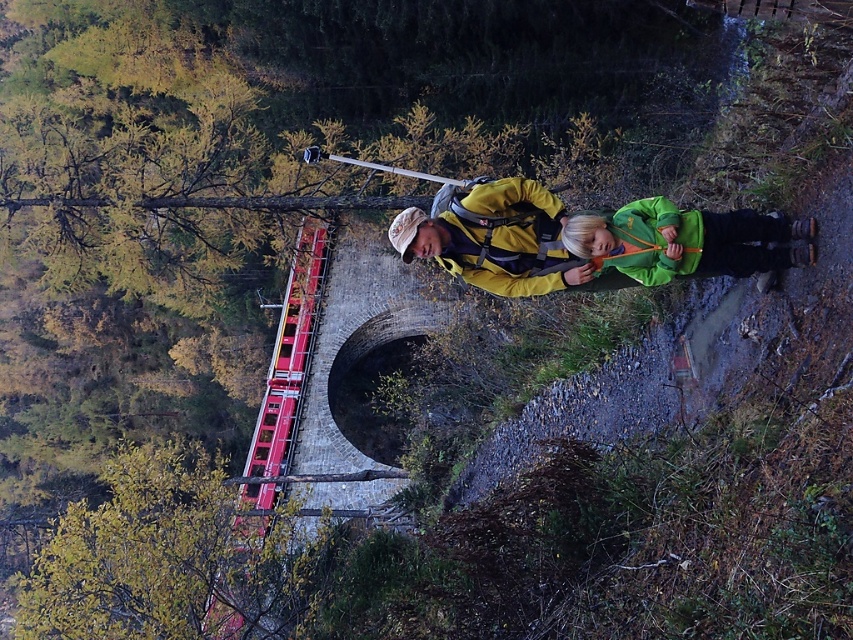
You are a photographer trying to capture the train passing through the arch bridge. You have a yellow matte jacket at center and a red plastic ladder at lower left in your frame. Which object should you move closer to ensure both are in focus, considering their sizes?

The yellow matte jacket at center is smaller than the red plastic ladder at lower left. To ensure both are in focus, you should move closer to the yellow matte jacket at center since it is smaller and needs to be enlarged in the frame for better visibility.

You are a photographer positioned on the gravel path and want to capture both the yellow matte jacket at center and the green fleece jacket at lower right in a single shot. Which jacket will appear closer to the camera in the photo?

The yellow matte jacket at center will appear closer to the camera because it is further to the viewer than the green fleece jacket at lower right, meaning it is positioned nearer to the photographer.